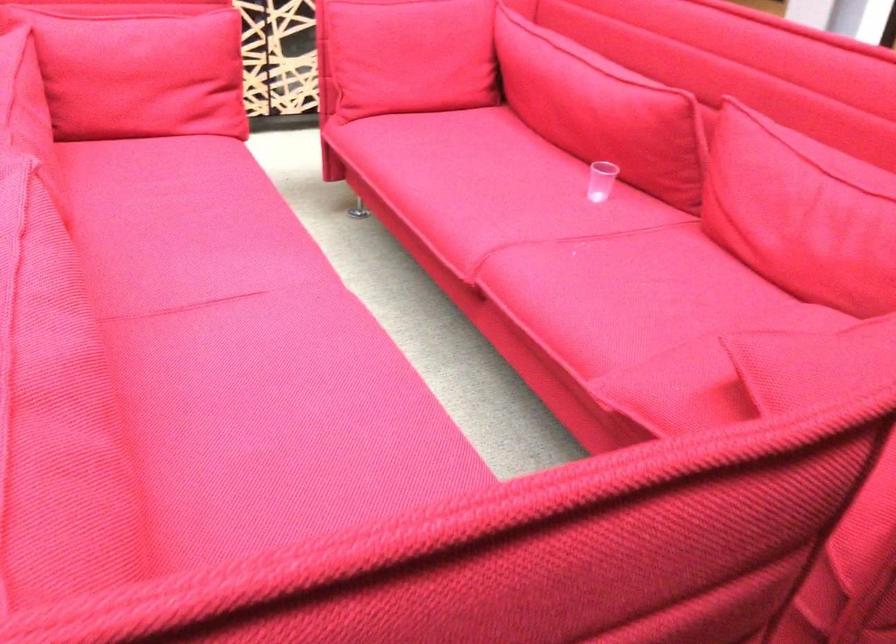
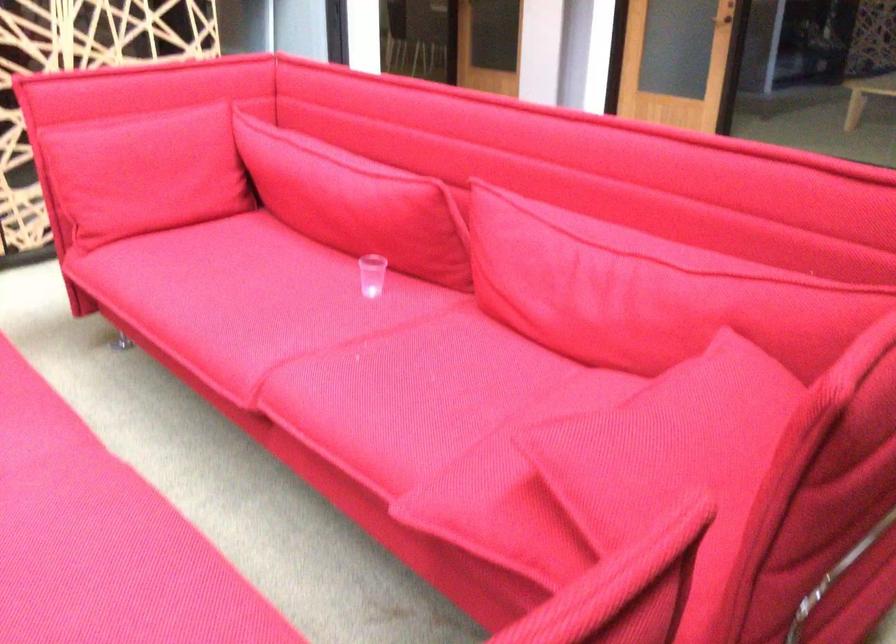
Question: The first image is from the beginning of the video and the second image is from the end. How did the camera likely rotate when shooting the video?

Choices:
 (A) Left
 (B) Right
 (C) Up
 (D) Down

Answer: (B)